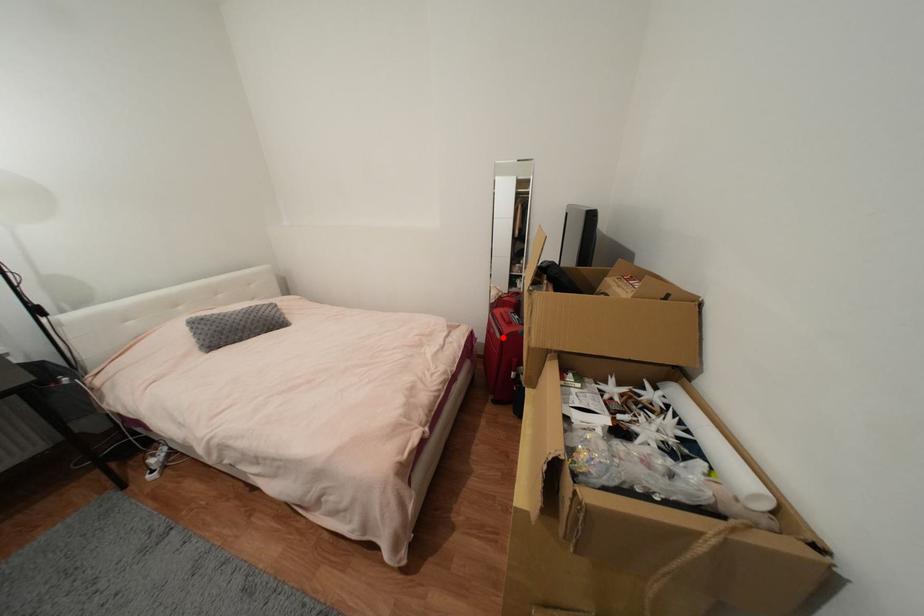
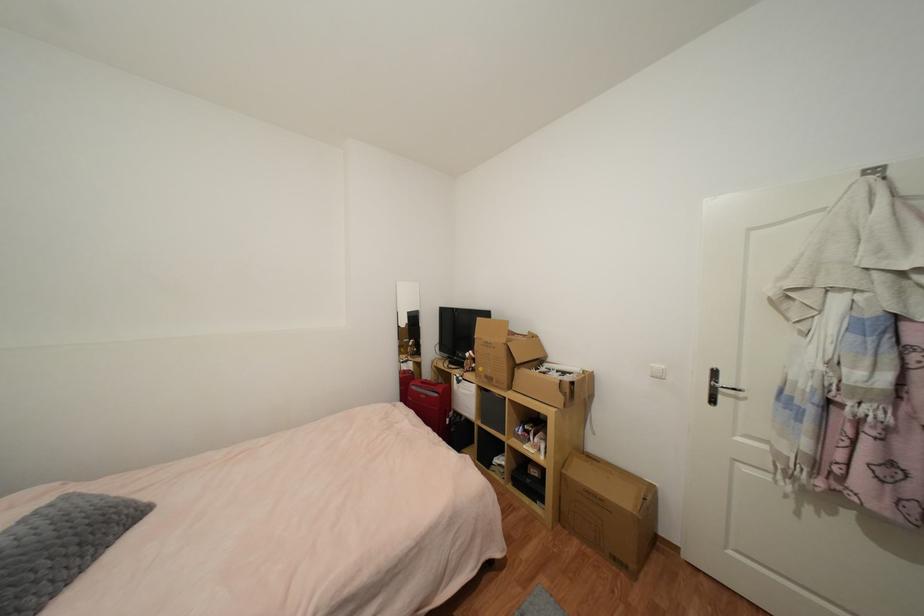
Question: I am providing you with two images of the same scene from different viewpoints. In image1, a red point is highlighted. Considering the same 3D point in image2, which of the following is correct?

Choices:
 (A) It is closer
 (B) It is farther

Answer: (B)